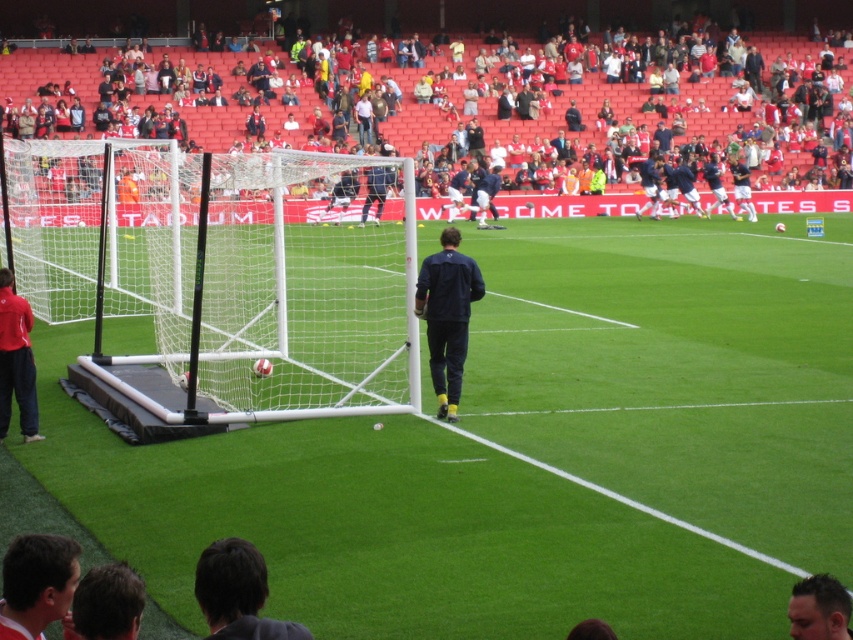
Who is more distant from viewer, (685,365) or (805,602)?

Positioned behind is point (685,365).

Does white synthetic turf at center appear under dark brown hair at lower right?

Incorrect, white synthetic turf at center is not positioned below dark brown hair at lower right.

Between point (242, 513) and point (813, 600), which one is positioned in front?

Point (813, 600)

Find the location of `white synthetic turf at center`. white synthetic turf at center is located at coordinates (531, 451).

The height and width of the screenshot is (640, 853). What do you see at coordinates (575, 64) in the screenshot?
I see `red fabric seats at upper center` at bounding box center [575, 64].

Between red fabric seats at upper center and dark brown hair at lower left, which one appears on the right side from the viewer's perspective?

red fabric seats at upper center

This screenshot has height=640, width=853. Describe the element at coordinates (575, 64) in the screenshot. I see `red fabric seats at upper center` at that location.

Where is `red fabric seats at upper center`? This screenshot has height=640, width=853. red fabric seats at upper center is located at coordinates (575, 64).

Between dark blue jersey at center and dark brown hair at lower left, which one is positioned higher?

dark blue jersey at center

Is dark blue jersey at center above dark brown hair at lower left?

Correct, dark blue jersey at center is located above dark brown hair at lower left.

I want to click on dark blue jersey at center, so click(447, 316).